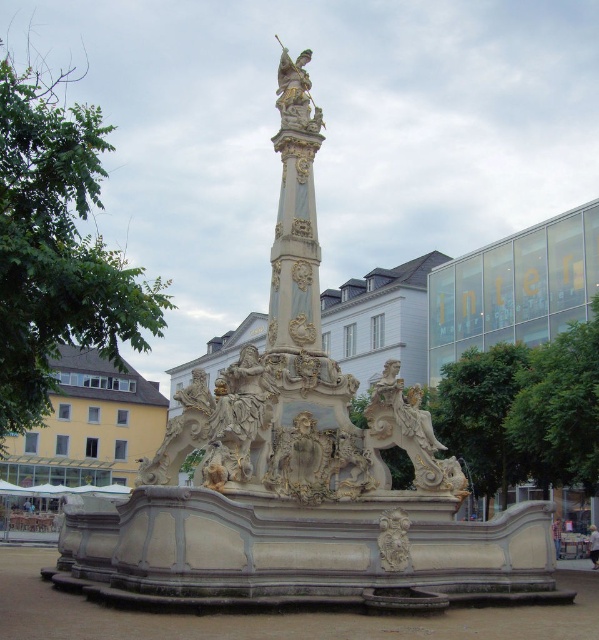
Question: Which object appears closest to the camera in this image?

Choices:
 (A) carved stone relief at center
 (B) gold ornate statue at center

Answer: (A)

Question: Is the position of gold ornate statue at center less distant than that of carved stone relief at center?

Choices:
 (A) yes
 (B) no

Answer: (B)

Question: Is gold ornate statue at center further to the viewer compared to carved stone relief at center?

Choices:
 (A) no
 (B) yes

Answer: (B)

Question: Which point appears closest to the camera in this image?

Choices:
 (A) (388, 513)
 (B) (285, 108)

Answer: (A)

Question: Among these points, which one is nearest to the camera?

Choices:
 (A) (301, 76)
 (B) (397, 538)

Answer: (B)

Question: Can you confirm if gold ornate statue at center is positioned to the left of carved stone relief at center?

Choices:
 (A) no
 (B) yes

Answer: (B)